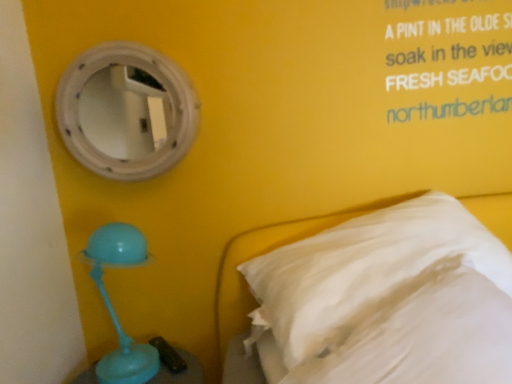
The image size is (512, 384). Describe the element at coordinates (391, 298) in the screenshot. I see `white soft pillow at right` at that location.

Locate an element on the screen. This screenshot has height=384, width=512. white soft pillow at right is located at coordinates click(x=391, y=298).

The height and width of the screenshot is (384, 512). What do you see at coordinates (126, 111) in the screenshot?
I see `white wooden mirror at upper left` at bounding box center [126, 111].

You are a GUI agent. You are given a task and a screenshot of the screen. Output one action in this format:
    pyautogui.click(x=<x>, y=<y>)
    Task: Click on the white wooden mirror at upper left
    
    Given the screenshot: What is the action you would take?
    pyautogui.click(x=126, y=111)

Where is `white soft pillow at right`? This screenshot has width=512, height=384. white soft pillow at right is located at coordinates (391, 298).

Considering the positions of objects white wooden mirror at upper left and white soft pillow at right in the image provided, who is more to the right, white wooden mirror at upper left or white soft pillow at right?

From the viewer's perspective, white soft pillow at right appears more on the right side.

Consider the image. Which object is closer to the camera, white wooden mirror at upper left or white soft pillow at right?

white soft pillow at right is in front.

Does point (131, 124) appear closer or farther from the camera than point (455, 207)?

Point (131, 124) is positioned farther from the camera compared to point (455, 207).

From the image's perspective, is white wooden mirror at upper left on white soft pillow at right?

Yes, from the image's perspective, white wooden mirror at upper left is on top of white soft pillow at right.

From a real-world perspective, is white wooden mirror at upper left located higher than white soft pillow at right?

Yes, from a real-world perspective, white wooden mirror at upper left is above white soft pillow at right.

Considering the relative sizes of white wooden mirror at upper left and white soft pillow at right in the image provided, is white wooden mirror at upper left thinner than white soft pillow at right?

Indeed, white wooden mirror at upper left has a lesser width compared to white soft pillow at right.

Can you confirm if white wooden mirror at upper left is taller than white soft pillow at right?

No.

Can you confirm if white wooden mirror at upper left is smaller than white soft pillow at right?

Yes.

Is white wooden mirror at upper left completely or partially outside of white soft pillow at right?

That's correct, white wooden mirror at upper left is outside of white soft pillow at right.

In the scene shown: Is the surface of white wooden mirror at upper left in direct contact with white soft pillow at right?

They are not placed beside each other.

Is white wooden mirror at upper left turned away from white soft pillow at right?

No, white wooden mirror at upper left is not facing the opposite direction of white soft pillow at right.

Measure the distance from white wooden mirror at upper left to white soft pillow at right.

white wooden mirror at upper left and white soft pillow at right are 1.30 meters apart.

Locate an element on the screen. mirror behind the white soft pillow at right is located at coordinates (126, 111).

Which is more to the right, white soft pillow at right or white wooden mirror at upper left?

white soft pillow at right is more to the right.

Is white soft pillow at right further to camera compared to white wooden mirror at upper left?

No, the depth of white soft pillow at right is less than that of white wooden mirror at upper left.

Is point (439, 252) farther from camera compared to point (110, 60)?

No.

From the image's perspective, is white soft pillow at right beneath white wooden mirror at upper left?

Yes, from the image's perspective, white soft pillow at right is below white wooden mirror at upper left.

From a real-world perspective, does white soft pillow at right sit lower than white wooden mirror at upper left?

Yes, from a real-world perspective, white soft pillow at right is beneath white wooden mirror at upper left.

Does white soft pillow at right have a greater width compared to white wooden mirror at upper left?

Yes, white soft pillow at right is wider than white wooden mirror at upper left.

Considering the sizes of objects white soft pillow at right and white wooden mirror at upper left in the image provided, who is shorter, white soft pillow at right or white wooden mirror at upper left?

white wooden mirror at upper left is shorter.

Who is bigger, white soft pillow at right or white wooden mirror at upper left?

Bigger between the two is white soft pillow at right.

Would you say white soft pillow at right contains white wooden mirror at upper left?

Actually, white wooden mirror at upper left is outside white soft pillow at right.

Can you see white soft pillow at right touching white wooden mirror at upper left?

white soft pillow at right and white wooden mirror at upper left are clearly separated.

Could you tell me if white soft pillow at right is turned towards white wooden mirror at upper left?

No, white soft pillow at right is not turned towards white wooden mirror at upper left.

At what (x,y) coordinates should I click in order to perform the action: click on mirror above the white soft pillow at right (from the image's perspective). Please return your answer as a coordinate pair (x, y). This screenshot has height=384, width=512. Looking at the image, I should click on (126, 111).

You are a GUI agent. You are given a task and a screenshot of the screen. Output one action in this format:
    pyautogui.click(x=<x>, y=<y>)
    Task: Click on the pillow on the right of white wooden mirror at upper left
    
    Given the screenshot: What is the action you would take?
    pyautogui.click(x=391, y=298)

The width and height of the screenshot is (512, 384). I want to click on mirror positioned vertically above the white soft pillow at right (from a real-world perspective), so [x=126, y=111].